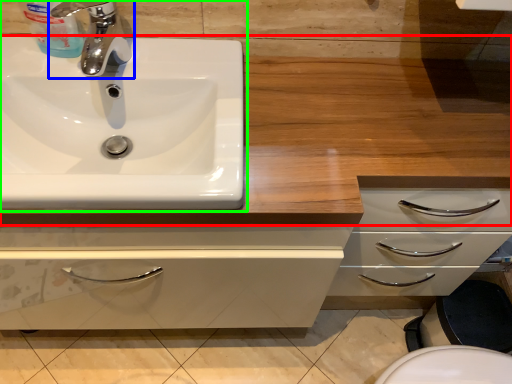
Question: Estimate the real-world distances between objects in this image. Which object is closer to counter top (highlighted by a red box), tap (highlighted by a blue box) or sink (highlighted by a green box)?

Choices:
 (A) tap
 (B) sink

Answer: (B)